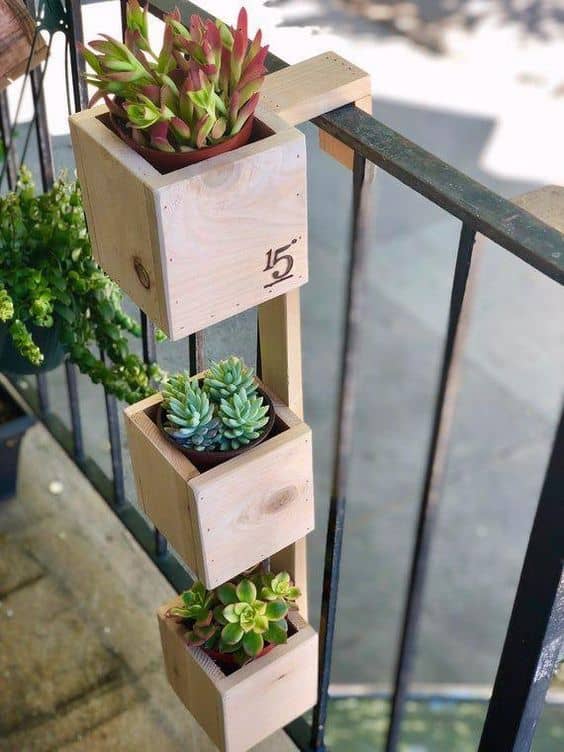
Image resolution: width=564 pixels, height=752 pixels. In order to click on flower pot in this screenshot , I will do `click(199, 450)`.